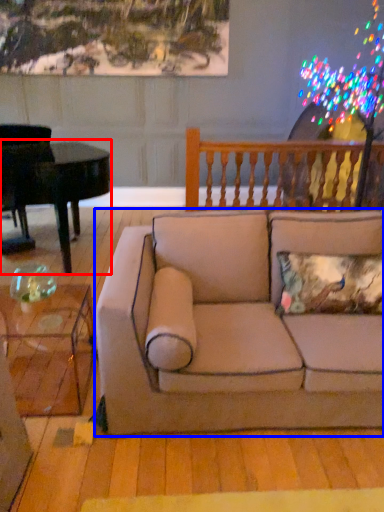
Question: Which of the following is the farthest to the observer, piano (highlighted by a red box) or studio couch (highlighted by a blue box)?

Choices:
 (A) piano
 (B) studio couch

Answer: (A)